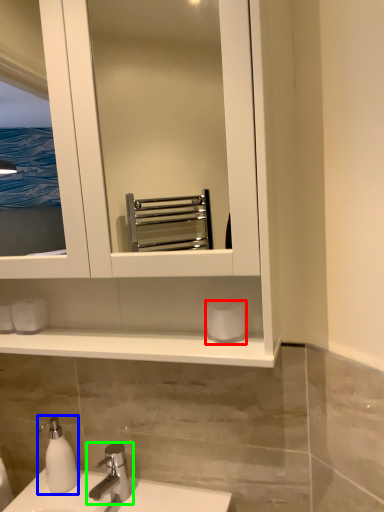
Question: Considering the real-world distances, which object is closest to toilet paper (highlighted by a red box)? soap dispenser (highlighted by a blue box) or tap (highlighted by a green box).

Choices:
 (A) soap dispenser
 (B) tap

Answer: (B)